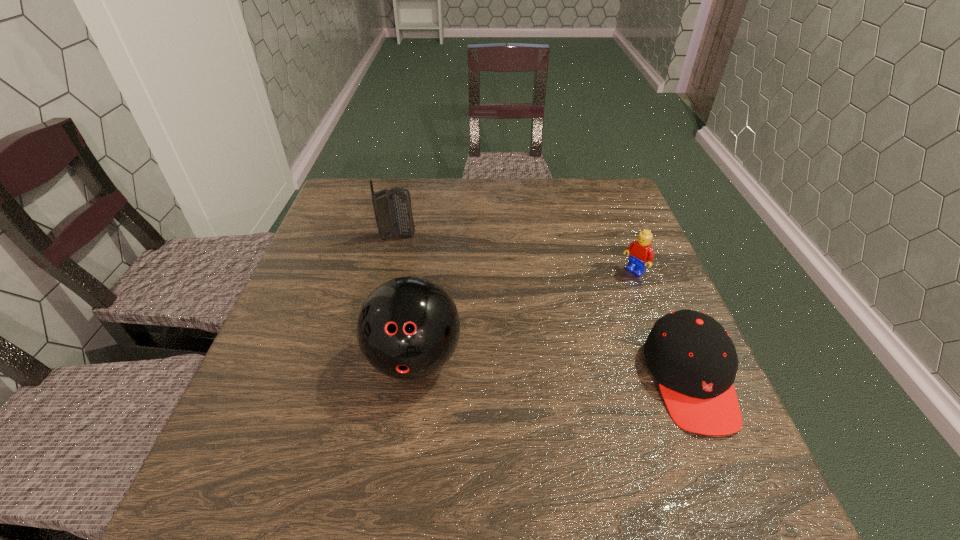
The height and width of the screenshot is (540, 960). I want to click on vacant area at the far right corner, so click(576, 200).

At what (x,y) coordinates should I click in order to perform the action: click on unoccupied area between the bowling ball and the cap. Please return your answer as a coordinate pair (x, y). Looking at the image, I should click on click(x=552, y=370).

Find the location of a particular element. The image size is (960, 540). empty space that is in between the bowling ball and the cap is located at coordinates (552, 370).

This screenshot has height=540, width=960. Find the location of `free spot between the second farthest object and the bowling ball`. free spot between the second farthest object and the bowling ball is located at coordinates (524, 316).

Where is `unoccupied area between the Lego and the bowling ball`? unoccupied area between the Lego and the bowling ball is located at coordinates (524, 316).

Find the location of a particular element. This screenshot has width=960, height=540. blank region between the third nearest object and the bowling ball is located at coordinates (524, 316).

Where is `unoccupied area between the farthest object and the cap`? This screenshot has height=540, width=960. unoccupied area between the farthest object and the cap is located at coordinates (544, 308).

Where is `vacant area that lies between the bowling ball and the Lego`? The width and height of the screenshot is (960, 540). vacant area that lies between the bowling ball and the Lego is located at coordinates (524, 316).

Find the location of a particular element. The height and width of the screenshot is (540, 960). the closest object to the cellular telephone is located at coordinates (407, 328).

The width and height of the screenshot is (960, 540). What are the coordinates of `object identified as the closest to the Lego` in the screenshot? It's located at (693, 358).